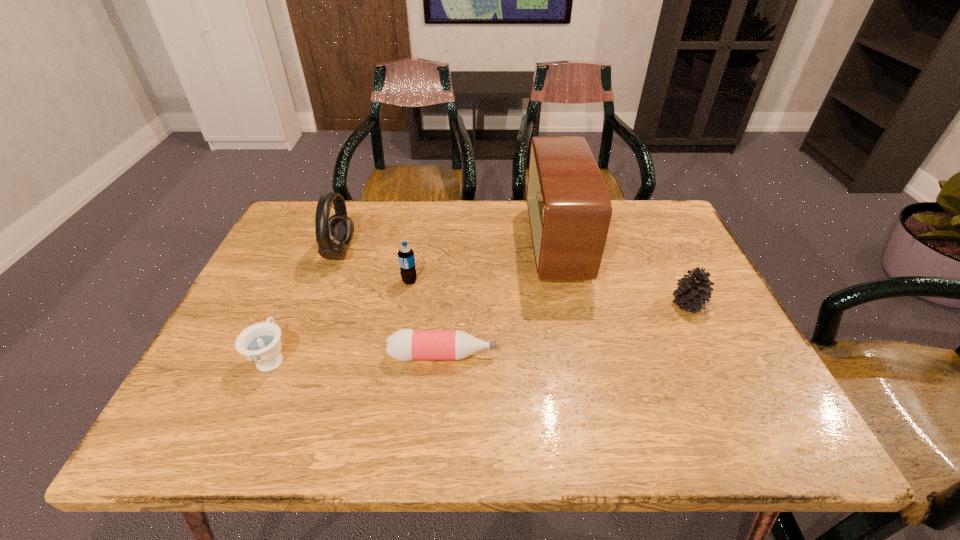
You are a GUI agent. You are given a task and a screenshot of the screen. Output one action in this format:
    pyautogui.click(x=<x>, y=<y>)
    Task: Click on the unoccupied area between the fifth object from left to right and the headset
    
    Given the screenshot: What is the action you would take?
    pyautogui.click(x=448, y=248)

At what (x,y) coordinates should I click in order to perform the action: click on object that is the second closest to the soda bottle. Please return your answer as a coordinate pair (x, y). The height and width of the screenshot is (540, 960). Looking at the image, I should click on (405, 345).

The image size is (960, 540). I want to click on object that ranks as the fifth closest to the teacup, so click(x=693, y=292).

This screenshot has height=540, width=960. In order to click on vacant space that satisfies the following two spatial constraints: 1. on the side of the soda bottle with the handle; 2. on the right side of the teacup in this screenshot , I will do pyautogui.click(x=305, y=281).